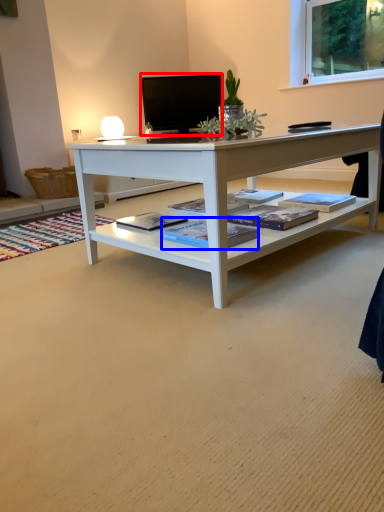
Question: Which of the following is the closest to the observer, television (highlighted by a red box) or book (highlighted by a blue box)?

Choices:
 (A) television
 (B) book

Answer: (B)